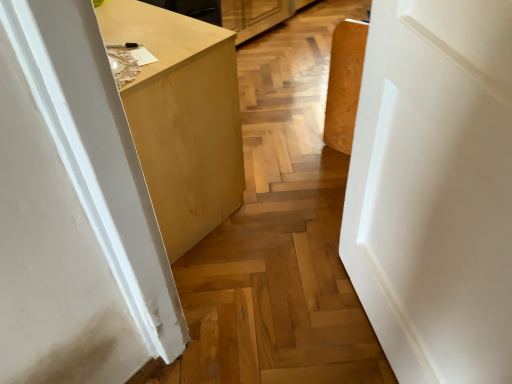
In order to face white matte door at center, should I rotate leftwards or rightwards?

A 19.115 degree turn to the right will do.

This screenshot has height=384, width=512. What do you see at coordinates (435, 189) in the screenshot? I see `white matte door at center` at bounding box center [435, 189].

I want to click on white matte door at center, so click(435, 189).

In order to face matte wood cabinet at center, should I rotate leftwards or rightwards?

To face it directly, rotate left by 19.444 degrees.

The image size is (512, 384). I want to click on matte wood cabinet at center, so click(182, 118).

The width and height of the screenshot is (512, 384). What do you see at coordinates (182, 118) in the screenshot?
I see `matte wood cabinet at center` at bounding box center [182, 118].

What is the approximate height of matte wood cabinet at center?

The height of matte wood cabinet at center is 24.47 inches.

You are a GUI agent. You are given a task and a screenshot of the screen. Output one action in this format:
    pyautogui.click(x=<x>, y=<y>)
    Task: Click on the white matte door at center
    
    Given the screenshot: What is the action you would take?
    pyautogui.click(x=435, y=189)

Does matte wood cabinet at center appear on the left side of white matte door at center?

Correct, you'll find matte wood cabinet at center to the left of white matte door at center.

Is matte wood cabinet at center positioned in front of white matte door at center?

No, it is behind white matte door at center.

Considering the positions of point (239, 136) and point (447, 253), is point (239, 136) closer or farther from the camera than point (447, 253)?

Clearly, point (239, 136) is more distant from the camera than point (447, 253).

From the image's perspective, is matte wood cabinet at center above white matte door at center?

Yes.

From a real-world perspective, is matte wood cabinet at center beneath white matte door at center?

Yes, from a real-world perspective, matte wood cabinet at center is under white matte door at center.

Is matte wood cabinet at center wider than white matte door at center?

Yes.

Considering the sizes of objects matte wood cabinet at center and white matte door at center in the image provided, who is taller, matte wood cabinet at center or white matte door at center?

With more height is white matte door at center.

Who is bigger, matte wood cabinet at center or white matte door at center?

With larger size is matte wood cabinet at center.

Do you think matte wood cabinet at center is within white matte door at center, or outside of it?

matte wood cabinet at center cannot be found inside white matte door at center.

Is matte wood cabinet at center beside white matte door at center?

They are not placed beside each other.

Is matte wood cabinet at center positioned with its back to white matte door at center?

No.

How different are the orientations of matte wood cabinet at center and white matte door at center in degrees?

The angular difference between matte wood cabinet at center and white matte door at center is 142 degrees.

You are a GUI agent. You are given a task and a screenshot of the screen. Output one action in this format:
    pyautogui.click(x=<x>, y=<y>)
    Task: Click on the cabinetry behind the white matte door at center
    The image size is (512, 384).
    Given the screenshot: What is the action you would take?
    pyautogui.click(x=182, y=118)

Which is more to the right, white matte door at center or matte wood cabinet at center?

white matte door at center.

Is white matte door at center positioned before matte wood cabinet at center?

Yes.

Is point (393, 310) more distant than point (233, 94)?

No, it is not.

From the image's perspective, between white matte door at center and matte wood cabinet at center, which one is located above?

matte wood cabinet at center.

Looking at this image, from a real-world perspective, which object stands above the other?

white matte door at center is physically above.

Based on the photo, can you confirm if white matte door at center is thinner than matte wood cabinet at center?

Yes, white matte door at center is thinner than matte wood cabinet at center.

In terms of height, does white matte door at center look taller or shorter compared to matte wood cabinet at center?

white matte door at center is taller than matte wood cabinet at center.

Between white matte door at center and matte wood cabinet at center, which one has smaller size?

Smaller between the two is white matte door at center.

Is matte wood cabinet at center surrounded by white matte door at center?

That's incorrect, matte wood cabinet at center is not inside white matte door at center.

Is white matte door at center far away from matte wood cabinet at center?

They are positioned close to each other.

Is white matte door at center aimed at matte wood cabinet at center?

No, white matte door at center is not facing towards matte wood cabinet at center.

Looking at this image, what's the angular difference between white matte door at center and matte wood cabinet at center's facing directions?

They differ by 142 degrees in their facing directions.

Locate an element on the screen. The image size is (512, 384). cabinetry behind the white matte door at center is located at coordinates (182, 118).

At what (x,y) coordinates should I click in order to perform the action: click on cabinetry located behind the white matte door at center. Please return your answer as a coordinate pair (x, y). The width and height of the screenshot is (512, 384). Looking at the image, I should click on (182, 118).

Where is `door in front of the matte wood cabinet at center`? door in front of the matte wood cabinet at center is located at coordinates (435, 189).